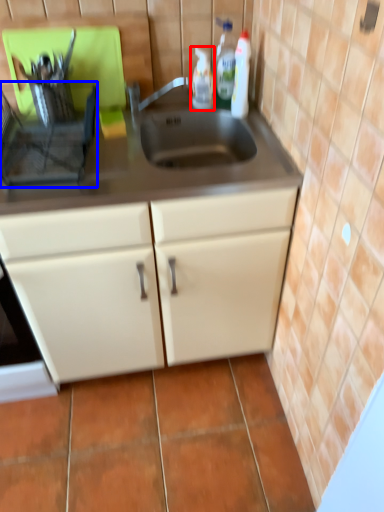
Question: Which of the following is the farthest to the observer, bottle (highlighted by a red box) or appliance (highlighted by a blue box)?

Choices:
 (A) bottle
 (B) appliance

Answer: (A)